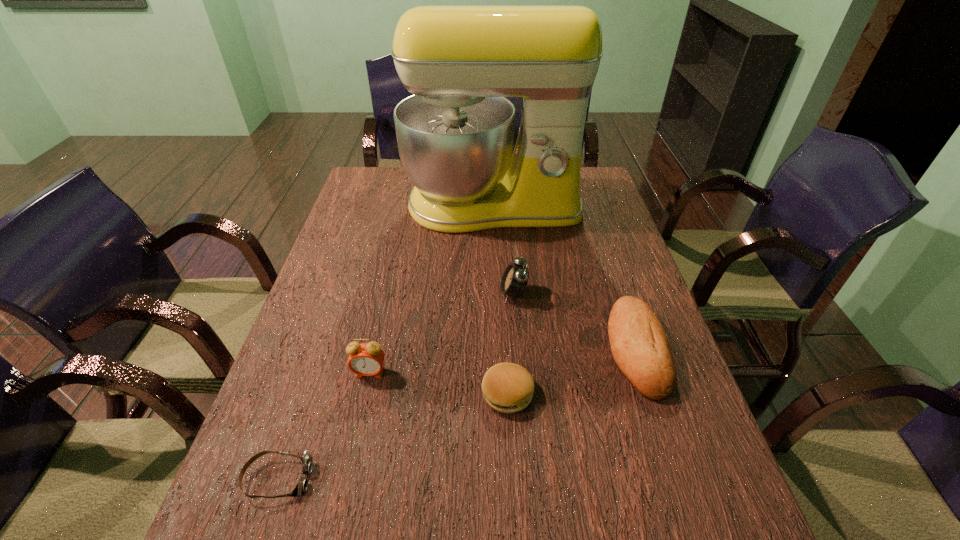
This screenshot has width=960, height=540. I want to click on bread located at the right edge, so click(x=640, y=347).

Where is `object located in the far right corner section of the desktop`? object located in the far right corner section of the desktop is located at coordinates click(455, 134).

Image resolution: width=960 pixels, height=540 pixels. What are the coordinates of `vacant space at the left edge of the desktop` in the screenshot? It's located at (356, 246).

Image resolution: width=960 pixels, height=540 pixels. Find the location of `free space at the right edge of the desktop`. free space at the right edge of the desktop is located at coordinates (690, 406).

The image size is (960, 540). In the image, there is a desktop. What are the coordinates of `vacant space at the far left corner` in the screenshot? It's located at (397, 174).

This screenshot has height=540, width=960. I want to click on empty space between the patty and the right alarm clock, so click(x=511, y=343).

Locate an element on the screen. vacant space that is in between the right alarm clock and the goggles is located at coordinates (396, 386).

What are the coordinates of `vacant area that lies between the farther alarm clock and the fourth tallest object` in the screenshot? It's located at (575, 321).

Locate an element on the screen. The width and height of the screenshot is (960, 540). vacant area between the fifth nearest object and the bread is located at coordinates (575, 321).

Identify the location of empty space that is in between the farthest object and the right alarm clock. (503, 250).